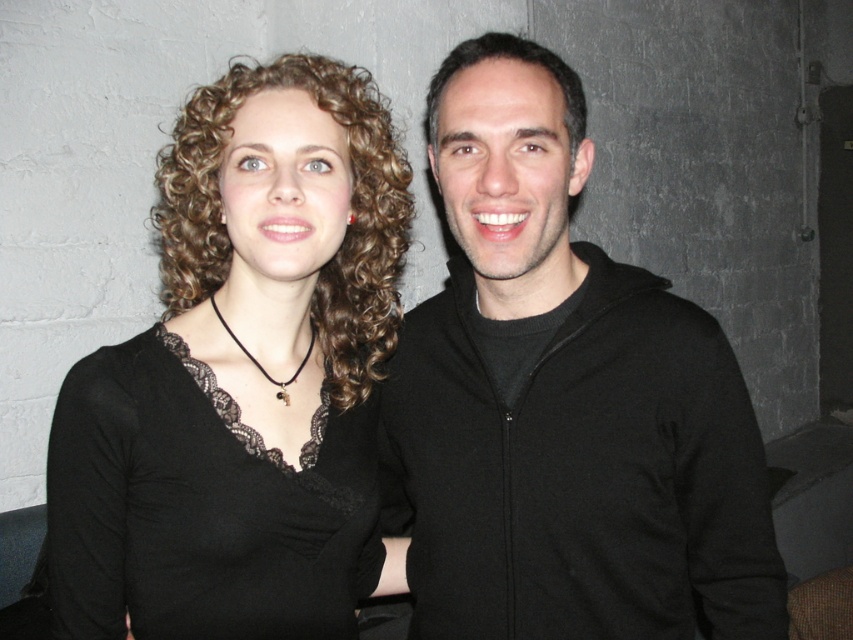
Is the position of black zip-up hoodie at right less distant than that of black lace top at center?

That is False.

Between point (547, 460) and point (396, 188), which one is positioned behind?

Point (396, 188)

What are the coordinates of `black zip-up hoodie at right` in the screenshot? It's located at (561, 401).

Does black lace top at center appear over black lace dress at left?

Yes.

Can you confirm if black lace top at center is positioned below black lace dress at left?

Incorrect, black lace top at center is not positioned below black lace dress at left.

Locate an element on the screen. black lace top at center is located at coordinates (241, 376).

Which is below, black zip-up hoodie at right or black lace dress at left?

black lace dress at left is below.

Who is taller, black zip-up hoodie at right or black lace dress at left?

With more height is black zip-up hoodie at right.

Who is more forward, (471, 388) or (94, 429)?

Point (94, 429) is more forward.

Image resolution: width=853 pixels, height=640 pixels. What are the coordinates of `black zip-up hoodie at right` in the screenshot? It's located at (561, 401).